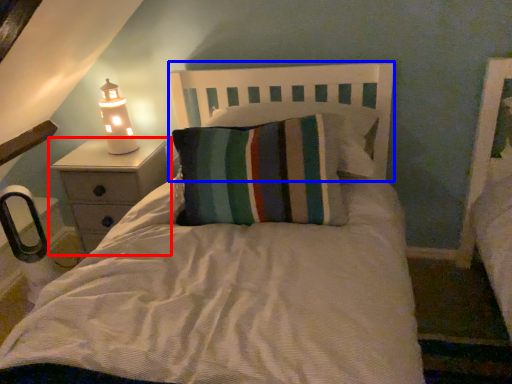
Question: Which object appears closest to the camera in this image, nightstand (highlighted by a red box) or headboard (highlighted by a blue box)?

Choices:
 (A) nightstand
 (B) headboard

Answer: (B)